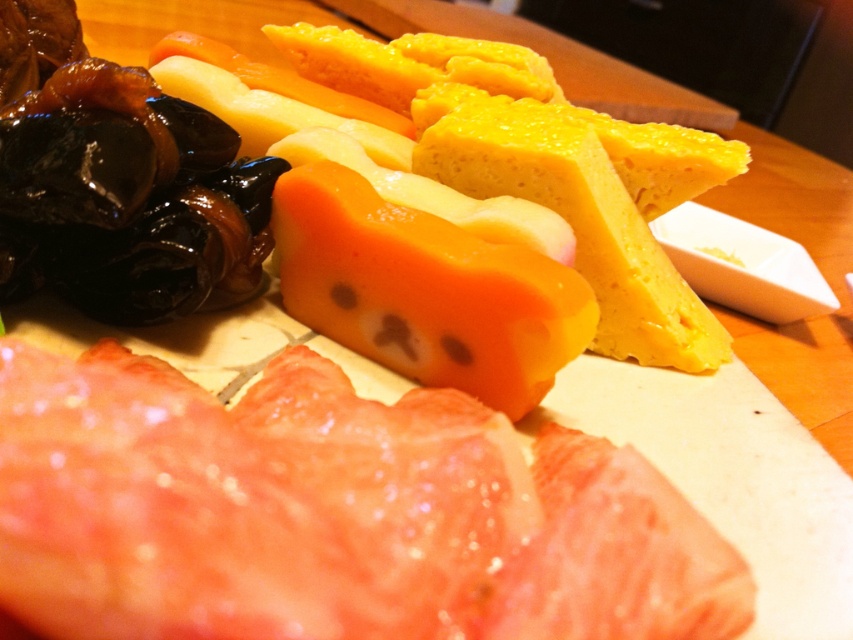
Does yellow crumbly cheese at upper center appear over yellow crumbly cheese at center?

Correct, yellow crumbly cheese at upper center is located above yellow crumbly cheese at center.

Between yellow crumbly cheese at upper center and yellow crumbly cheese at center, which one is positioned higher?

yellow crumbly cheese at upper center is above.

Does point (631, 125) come closer to viewer compared to point (473, 134)?

No, it is behind (473, 134).

You are a GUI agent. You are given a task and a screenshot of the screen. Output one action in this format:
    pyautogui.click(x=<x>, y=<y>)
    Task: Click on the yellow crumbly cheese at upper center
    This screenshot has width=853, height=640.
    Given the screenshot: What is the action you would take?
    pos(544,193)

Who is taller, pink raw meat at lower left or yellow crumbly cheese at center?

yellow crumbly cheese at center

Which is below, pink raw meat at lower left or yellow crumbly cheese at center?

pink raw meat at lower left is below.

Between point (287, 588) and point (584, 244), which one is positioned behind?

Point (584, 244)

I want to click on pink raw meat at lower left, so click(329, 515).

Consider the image. Is pink raw meat at lower left closer to the viewer compared to yellow crumbly cheese at upper center?

Yes, it is in front of yellow crumbly cheese at upper center.

Locate an element on the screen. The width and height of the screenshot is (853, 640). pink raw meat at lower left is located at coordinates (329, 515).

Which is behind, point (126, 531) or point (573, 220)?

The point (573, 220) is more distant.

Where is `pink raw meat at lower left`? The image size is (853, 640). pink raw meat at lower left is located at coordinates (329, 515).